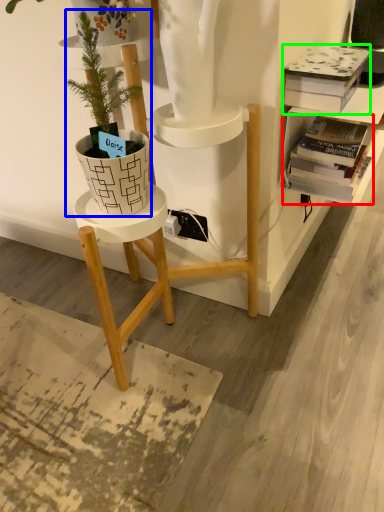
Question: Based on their relative distances, which object is farther from book (highlighted by a red box)? Choose from houseplant (highlighted by a blue box) and book (highlighted by a green box).

Choices:
 (A) houseplant
 (B) book

Answer: (A)